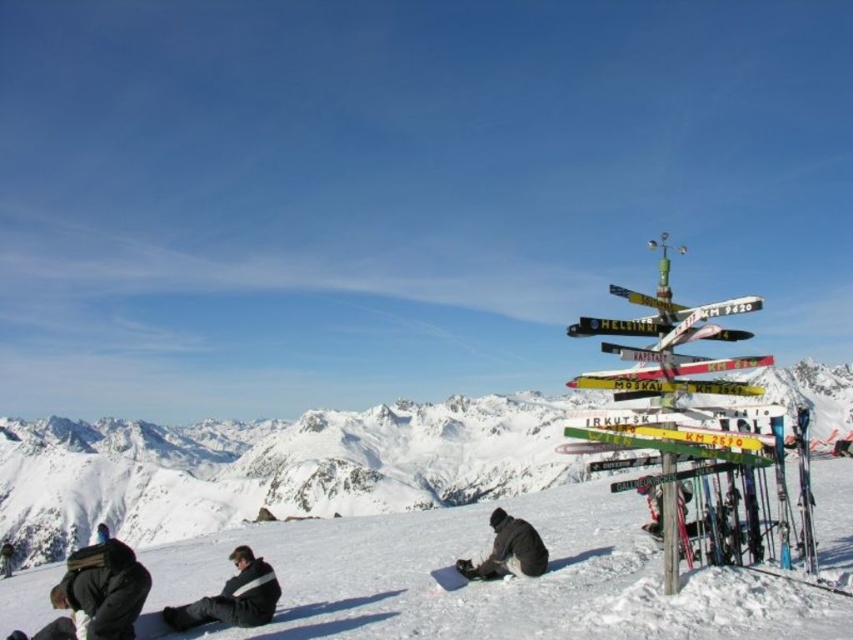
In the scene shown: Who is shorter, white powdery snow at lower center or white snow mountain at center?

white powdery snow at lower center is shorter.

Is the position of white powdery snow at lower center less distant than that of white snow mountain at center?

Yes, white powdery snow at lower center is in front of white snow mountain at center.

Is point (543, 580) more distant than point (782, 394)?

That is False.

The height and width of the screenshot is (640, 853). I want to click on white powdery snow at lower center, so click(491, 582).

Between dark gray jacket at lower left and black fleece jacket at lower left, which one has less height?

Standing shorter between the two is dark gray jacket at lower left.

Can you confirm if dark gray jacket at lower left is positioned to the left of black fleece jacket at lower left?

Indeed, dark gray jacket at lower left is positioned on the left side of black fleece jacket at lower left.

Does point (114, 572) come closer to viewer compared to point (180, 605)?

Yes, it is.

This screenshot has width=853, height=640. Identify the location of dark gray jacket at lower left. (102, 589).

Is point (434, 605) more distant than point (93, 634)?

Yes.

Who is higher up, white powdery snow at lower center or dark gray jacket at lower left?

Positioned higher is dark gray jacket at lower left.

Does point (370, 525) come farther from viewer compared to point (91, 637)?

Yes, it is.

Find the location of a particular element. This screenshot has width=853, height=640. white powdery snow at lower center is located at coordinates (491, 582).